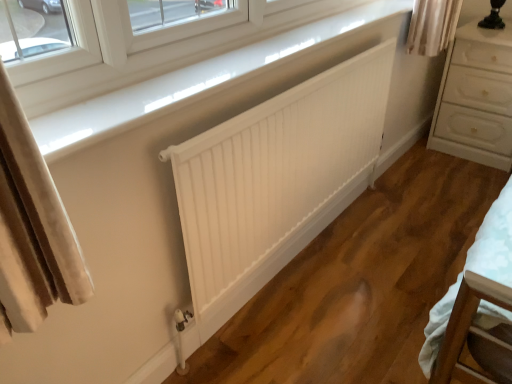
This screenshot has width=512, height=384. Describe the element at coordinates (155, 56) in the screenshot. I see `white glossy window sill at upper center` at that location.

At what (x,y) coordinates should I click in order to perform the action: click on white glossy window sill at upper center. Please return your answer as a coordinate pair (x, y). Looking at the image, I should click on (155, 56).

This screenshot has width=512, height=384. I want to click on white matte radiator at center, so click(x=276, y=180).

The height and width of the screenshot is (384, 512). What do you see at coordinates (476, 98) in the screenshot? I see `white glossy chest of drawers at right` at bounding box center [476, 98].

I want to click on white glossy window sill at upper center, so click(x=155, y=56).

From the image's perspective, is white glossy chest of drawers at right over white matte radiator at center?

Yes.

Does white glossy chest of drawers at right have a smaller size compared to white matte radiator at center?

Actually, white glossy chest of drawers at right might be larger than white matte radiator at center.

Between white glossy chest of drawers at right and white matte radiator at center, which one is positioned behind?

white glossy chest of drawers at right is more distant.

How different are the orientations of white glossy chest of drawers at right and white glossy window sill at upper center in degrees?

91.1 degrees separate the facing orientations of white glossy chest of drawers at right and white glossy window sill at upper center.

Where is `the chest of drawers located underneath the white glossy window sill at upper center (from a real-world perspective)`? the chest of drawers located underneath the white glossy window sill at upper center (from a real-world perspective) is located at coordinates (476, 98).

Looking at this image, considering the relative positions of white glossy chest of drawers at right and white glossy window sill at upper center in the image provided, is white glossy chest of drawers at right to the right of white glossy window sill at upper center from the viewer's perspective?

Yes, white glossy chest of drawers at right is to the right of white glossy window sill at upper center.

From the image's perspective, between white glossy chest of drawers at right and white glossy window sill at upper center, which one is located above?

From the image's view, white glossy chest of drawers at right is above.

What's the angular difference between white glossy window sill at upper center and white glossy chest of drawers at right's facing directions?

91.1 degrees separate the facing orientations of white glossy window sill at upper center and white glossy chest of drawers at right.

Which is more to the left, white glossy window sill at upper center or white glossy chest of drawers at right?

Positioned to the left is white glossy window sill at upper center.

Does white glossy window sill at upper center turn towards white glossy chest of drawers at right?

No, white glossy window sill at upper center is not aimed at white glossy chest of drawers at right.

Is white glossy window sill at upper center taller than white glossy chest of drawers at right?

No, white glossy window sill at upper center is not taller than white glossy chest of drawers at right.

How different are the orientations of white matte radiator at center and white glossy window sill at upper center in degrees?

They differ by 0.0152 degrees in their facing directions.

From the image's perspective, which is below, white matte radiator at center or white glossy window sill at upper center?

From the image's view, white matte radiator at center is below.

In terms of height, does white matte radiator at center look taller or shorter compared to white glossy window sill at upper center?

Considering their sizes, white matte radiator at center has more height than white glossy window sill at upper center.

Considering the positions of objects white matte radiator at center and white glossy window sill at upper center in the image provided, who is in front, white matte radiator at center or white glossy window sill at upper center?

white glossy window sill at upper center is closer to the camera.

Between white glossy window sill at upper center and white matte radiator at center, which one has smaller size?

Smaller between the two is white glossy window sill at upper center.

Which is more to the left, white glossy window sill at upper center or white matte radiator at center?

white glossy window sill at upper center is more to the left.

How much distance is there between white glossy window sill at upper center and white matte radiator at center?

white glossy window sill at upper center is 17.58 inches from white matte radiator at center.

Is white glossy window sill at upper center positioned beyond the bounds of white matte radiator at center?

Absolutely, white glossy window sill at upper center is external to white matte radiator at center.

Is white glossy chest of drawers at right a part of white matte radiator at center?

Actually, white glossy chest of drawers at right is outside white matte radiator at center.

Can you confirm if white matte radiator at center is smaller than white glossy chest of drawers at right?

Yes, white matte radiator at center is smaller than white glossy chest of drawers at right.

Can you confirm if white matte radiator at center is shorter than white glossy chest of drawers at right?

No, white matte radiator at center is not shorter than white glossy chest of drawers at right.

Find the location of a particular element. This screenshot has width=512, height=384. radiator that is above the white glossy chest of drawers at right (from a real-world perspective) is located at coordinates (276, 180).

The height and width of the screenshot is (384, 512). What are the coordinates of `window that appears in front of the white glossy chest of drawers at right` in the screenshot? It's located at (155, 56).

Considering their positions, is white glossy window sill at upper center positioned closer to white glossy chest of drawers at right than white matte radiator at center?

white matte radiator at center is positioned closer to the anchor white glossy chest of drawers at right.

Considering their positions, is white glossy window sill at upper center positioned further to white matte radiator at center than white glossy chest of drawers at right?

white glossy chest of drawers at right.

Looking at the image, which one is located closer to white glossy window sill at upper center, white glossy chest of drawers at right or white matte radiator at center?

Based on the image, white matte radiator at center appears to be nearer to white glossy window sill at upper center.

Which object lies further to the anchor point white matte radiator at center, white glossy chest of drawers at right or white glossy window sill at upper center?

Based on the image, white glossy chest of drawers at right appears to be further to white matte radiator at center.

Considering their positions, is white matte radiator at center positioned further to white glossy window sill at upper center than white glossy chest of drawers at right?

white glossy chest of drawers at right is positioned further to the anchor white glossy window sill at upper center.

Looking at the image, which one is located further to white glossy chest of drawers at right, white matte radiator at center or white glossy window sill at upper center?

white glossy window sill at upper center is further to white glossy chest of drawers at right.

What are the coordinates of `radiator between white glossy window sill at upper center and white glossy chest of drawers at right in the front-back direction` in the screenshot? It's located at (276, 180).